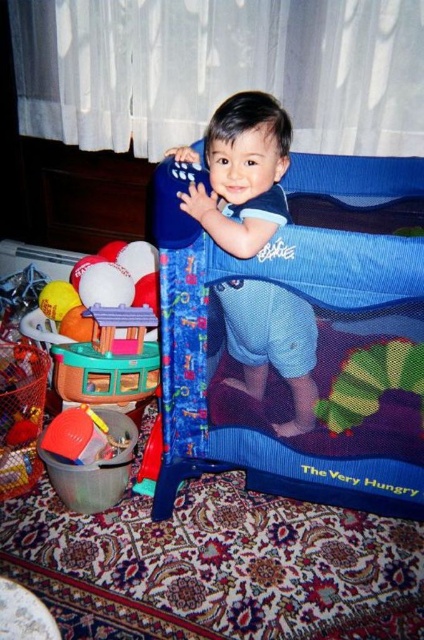
Can you confirm if blue fabric playpen at center is bigger than blue mesh playpen at center?

Correct, blue fabric playpen at center is larger in size than blue mesh playpen at center.

Is blue fabric playpen at center below blue mesh playpen at center?

Yes.

This screenshot has width=424, height=640. I want to click on blue fabric playpen at center, so click(284, 381).

Identify the location of blue fabric playpen at center. This screenshot has height=640, width=424. (284, 381).